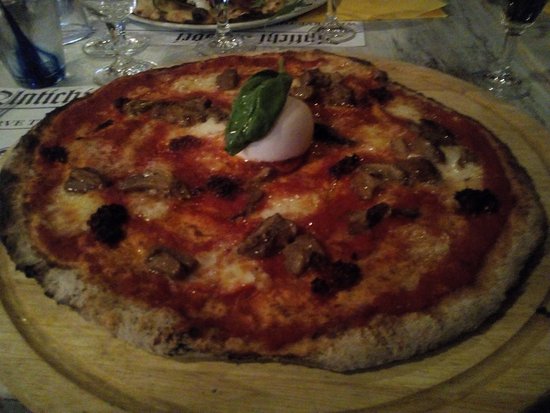
Identify the location of glass. (25, 20).